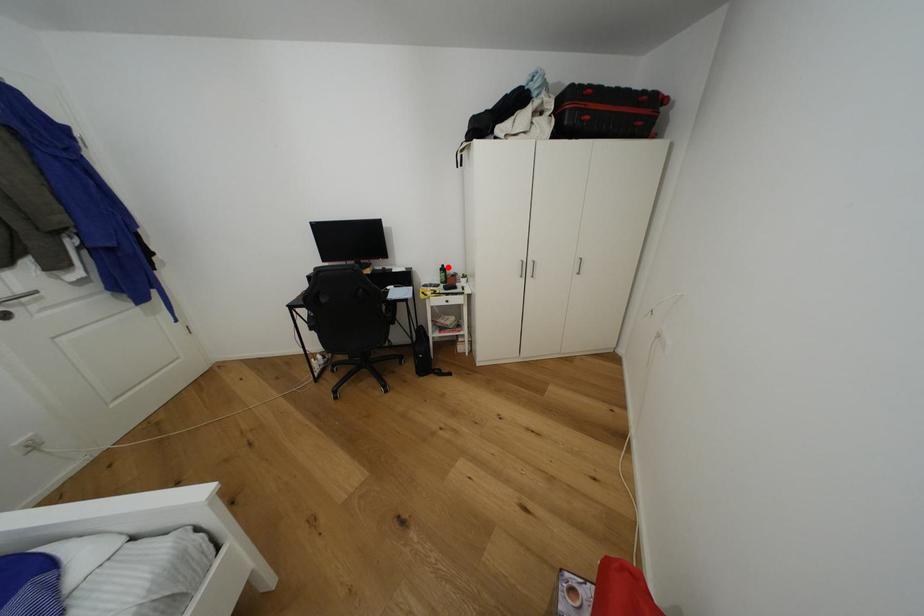
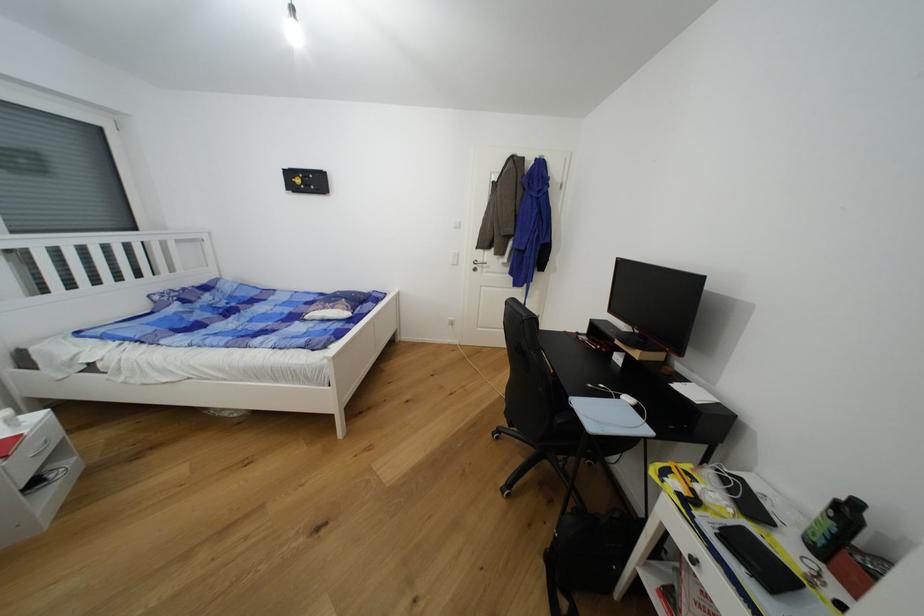
Locate, in the second image, the point that corresponds to the highlighted location in the first image.

(862, 506)